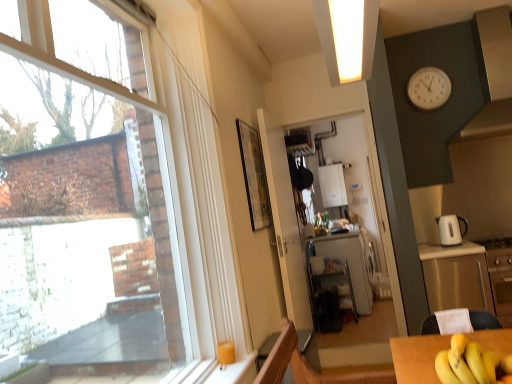
Question: Does stainless steel cabinet at right appear on the left side of white glossy refrigerator at center?

Choices:
 (A) no
 (B) yes

Answer: (A)

Question: Can you confirm if stainless steel cabinet at right is smaller than white glossy refrigerator at center?

Choices:
 (A) no
 (B) yes

Answer: (A)

Question: From a real-world perspective, is stainless steel cabinet at right over white glossy refrigerator at center?

Choices:
 (A) yes
 (B) no

Answer: (B)

Question: Does stainless steel cabinet at right turn towards white glossy refrigerator at center?

Choices:
 (A) yes
 (B) no

Answer: (B)

Question: From the image's perspective, is stainless steel cabinet at right located beneath white glossy refrigerator at center?

Choices:
 (A) yes
 (B) no

Answer: (A)

Question: Is the surface of stainless steel cabinet at right in direct contact with white glossy refrigerator at center?

Choices:
 (A) yes
 (B) no

Answer: (B)

Question: Would you consider wooden framed artwork at center to be distant from white plastic clock at upper right?

Choices:
 (A) no
 (B) yes

Answer: (B)

Question: From a real-world perspective, does wooden framed artwork at center sit lower than white plastic clock at upper right?

Choices:
 (A) yes
 (B) no

Answer: (A)

Question: From a real-world perspective, does wooden framed artwork at center stand above white plastic clock at upper right?

Choices:
 (A) yes
 (B) no

Answer: (B)

Question: Considering the relative positions of wooden framed artwork at center and white plastic clock at upper right in the image provided, is wooden framed artwork at center in front of white plastic clock at upper right?

Choices:
 (A) no
 (B) yes

Answer: (B)

Question: Considering the relative sizes of wooden framed artwork at center and white plastic clock at upper right in the image provided, is wooden framed artwork at center wider than white plastic clock at upper right?

Choices:
 (A) yes
 (B) no

Answer: (B)

Question: Is wooden framed artwork at center positioned with its back to white plastic clock at upper right?

Choices:
 (A) yes
 (B) no

Answer: (B)

Question: Are white glossy exhaust hood at upper right and white plastic clock at upper right beside each other?

Choices:
 (A) no
 (B) yes

Answer: (A)